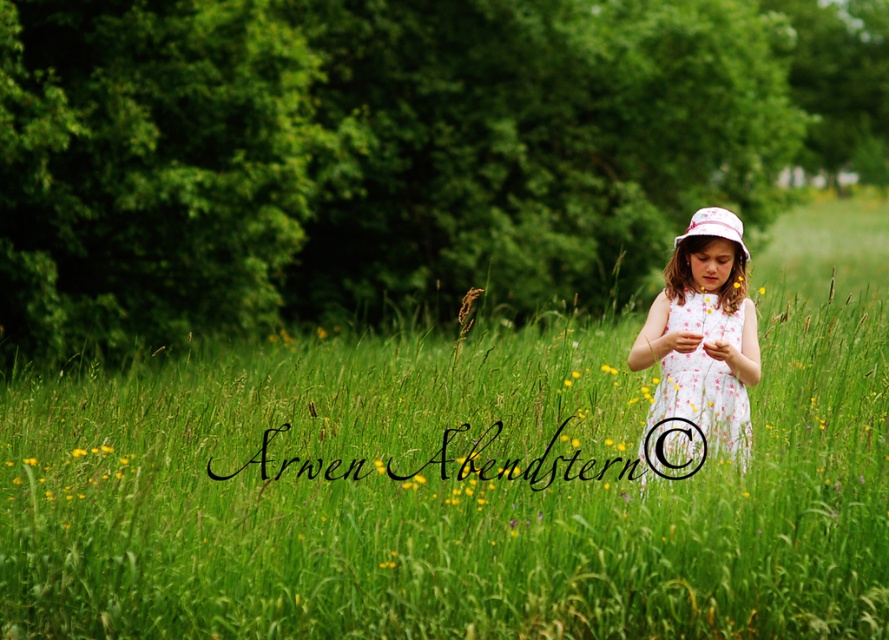
Measure the distance between pink fabric bucket hat at center and camera.

7.25 meters

Is point (698, 221) positioned before point (86, 451)?

Yes, it is in front of point (86, 451).

Locate an element on the screen. pink fabric bucket hat at center is located at coordinates (715, 227).

Does white dotted dress at center appear on the right side of yellow soft grass at center?

Yes, white dotted dress at center is to the right of yellow soft grass at center.

Describe the element at coordinates (702, 330) in the screenshot. I see `white dotted dress at center` at that location.

Is point (698, 412) positioned in front of point (74, 448)?

Yes, point (698, 412) is closer to viewer.

Find the location of a particular element. white dotted dress at center is located at coordinates (702, 330).

Does green grassy field at center have a greater width compared to yellow soft grass at center?

Yes, green grassy field at center is wider than yellow soft grass at center.

Is green grassy field at center below yellow soft grass at center?

Incorrect, green grassy field at center is not positioned below yellow soft grass at center.

The height and width of the screenshot is (640, 889). What do you see at coordinates (463, 481) in the screenshot?
I see `green grassy field at center` at bounding box center [463, 481].

The image size is (889, 640). In order to click on green grassy field at center in this screenshot , I will do `click(463, 481)`.